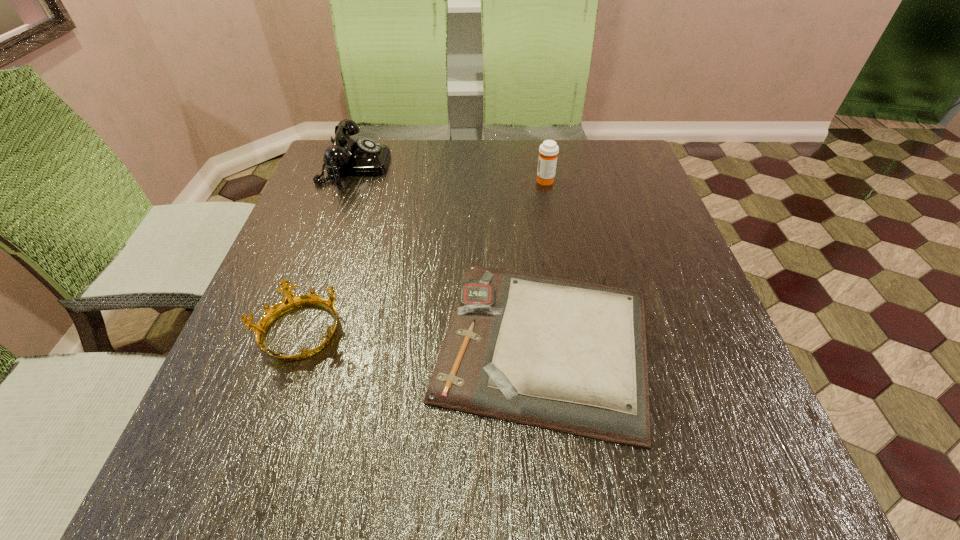
The width and height of the screenshot is (960, 540). Find the location of `free space at the far left corner`. free space at the far left corner is located at coordinates (366, 179).

The width and height of the screenshot is (960, 540). In the image, there is a desktop. What are the coordinates of `vacant space at the far right corner` in the screenshot? It's located at (587, 173).

What are the coordinates of `vacant area that lies between the crown and the telephone` in the screenshot? It's located at (327, 249).

Where is `free space between the telephone and the shortest object`? The height and width of the screenshot is (540, 960). free space between the telephone and the shortest object is located at coordinates (449, 254).

Find the location of a particular element. This screenshot has width=960, height=540. vacant space that's between the medicine and the crown is located at coordinates (422, 256).

You are a GUI agent. You are given a task and a screenshot of the screen. Output one action in this format:
    pyautogui.click(x=<x>, y=<y>)
    Task: Click on the vacant area that lies between the telephone and the clipboard
    
    Given the screenshot: What is the action you would take?
    pyautogui.click(x=449, y=254)

Identify the location of vacant region between the clipboard and the second shortest object. (421, 338).

At what (x,y) coordinates should I click in order to perform the action: click on vacant space that's between the medicine and the crown. Please return your answer as a coordinate pair (x, y). This screenshot has width=960, height=540. Looking at the image, I should click on coord(422,256).

Where is `vacant area between the telephone and the medicine`? vacant area between the telephone and the medicine is located at coordinates (450, 173).

This screenshot has height=540, width=960. Find the location of `vacant region between the crown and the telephone`. vacant region between the crown and the telephone is located at coordinates (327, 249).